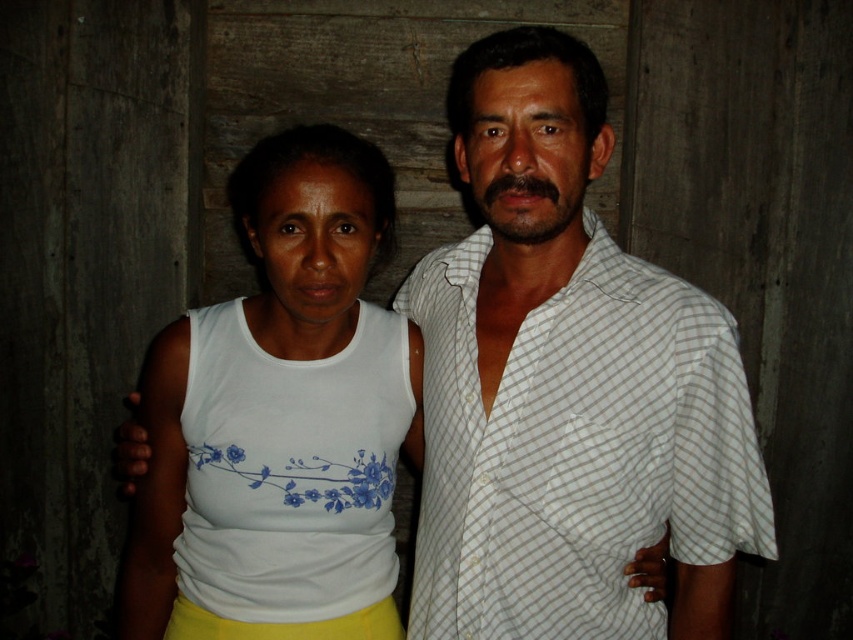
Question: In this image, where is white checkered shirt at right located relative to white fabric tank top at center?

Choices:
 (A) below
 (B) above

Answer: (A)

Question: Is white cotton shirt at center further to camera compared to white checkered shirt at right?

Choices:
 (A) yes
 (B) no

Answer: (B)

Question: Among these points, which one is farthest from the camera?

Choices:
 (A) pyautogui.click(x=619, y=474)
 (B) pyautogui.click(x=485, y=609)
 (C) pyautogui.click(x=282, y=364)

Answer: (C)

Question: Estimate the real-world distances between objects in this image. Which object is farther from the white fabric tank top at center?

Choices:
 (A) white cotton shirt at center
 (B) white checkered shirt at right

Answer: (B)

Question: Which point is farther from the camera taking this photo?

Choices:
 (A) (524, 356)
 (B) (267, 163)

Answer: (A)

Question: Is white checkered shirt at right below white fabric tank top at center?

Choices:
 (A) yes
 (B) no

Answer: (A)